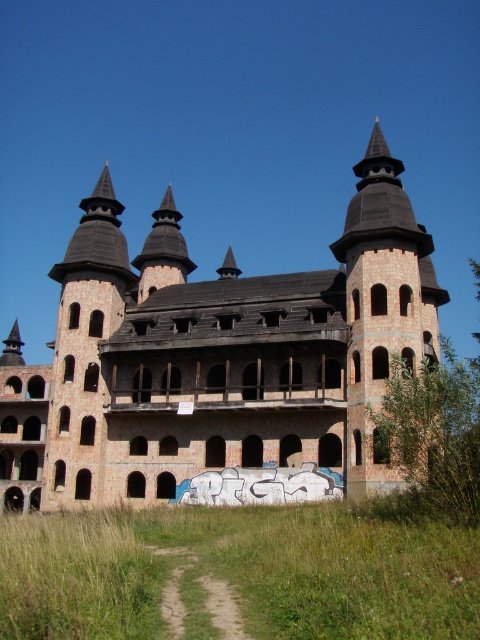
Does brown brick castle at center have a lesser width compared to brown stone tower at upper right?

Incorrect, brown brick castle at center's width is not less than brown stone tower at upper right's.

Does brown brick castle at center appear on the left side of brown stone tower at upper right?

Indeed, brown brick castle at center is positioned on the left side of brown stone tower at upper right.

Image resolution: width=480 pixels, height=640 pixels. Identify the location of brown brick castle at center. (215, 355).